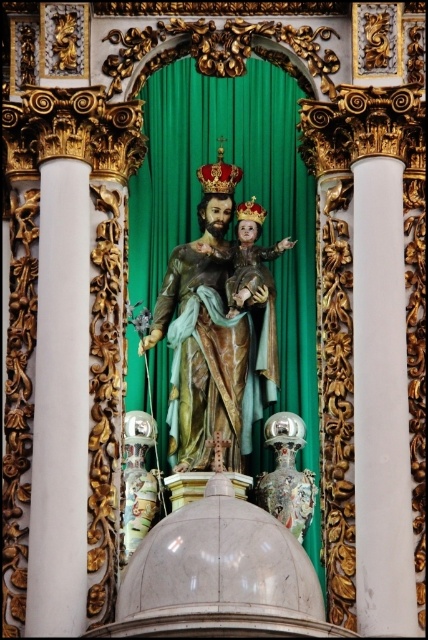
Question: Does polychrome wood statue at center lie in front of white smooth column at right?

Choices:
 (A) yes
 (B) no

Answer: (B)

Question: Which of the following is the closest to the observer?

Choices:
 (A) white smooth column at right
 (B) polychrome wood statue at center

Answer: (A)

Question: Can you confirm if polychrome wood statue at center is positioned above white smooth column at right?

Choices:
 (A) yes
 (B) no

Answer: (A)

Question: Does green velvet curtain at center have a greater width compared to white smooth column at right?

Choices:
 (A) yes
 (B) no

Answer: (A)

Question: Which point appears closest to the camera in this image?

Choices:
 (A) click(270, 378)
 (B) click(377, 209)

Answer: (B)

Question: Which of the following is the farthest from the observer?

Choices:
 (A) green velvet curtain at center
 (B) polychrome wood statue at center

Answer: (B)